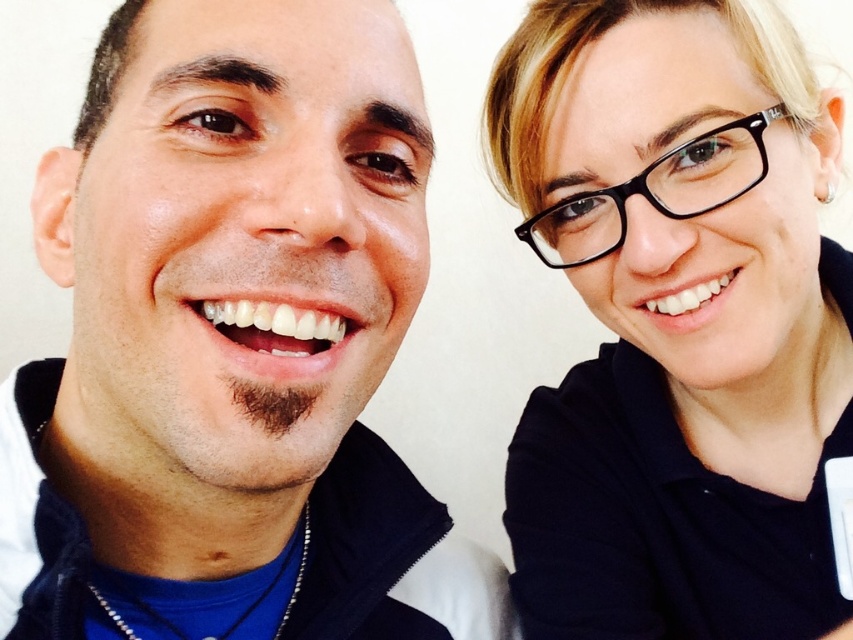
Question: Which of the following is the closest to the observer?

Choices:
 (A) matte black jacket at left
 (B) black matte glasses at upper right

Answer: (A)

Question: Is matte black jacket at left to the left of black matte glasses at upper right from the viewer's perspective?

Choices:
 (A) yes
 (B) no

Answer: (A)

Question: Which point is farther to the camera?

Choices:
 (A) coord(39,387)
 (B) coord(643,396)

Answer: (B)

Question: Can you confirm if matte black jacket at left is positioned below black matte glasses at upper right?

Choices:
 (A) no
 (B) yes

Answer: (B)

Question: Can you confirm if matte black jacket at left is smaller than black matte glasses at upper right?

Choices:
 (A) no
 (B) yes

Answer: (B)

Question: Among these objects, which one is nearest to the camera?

Choices:
 (A) black matte glasses at upper right
 (B) matte black jacket at left

Answer: (B)